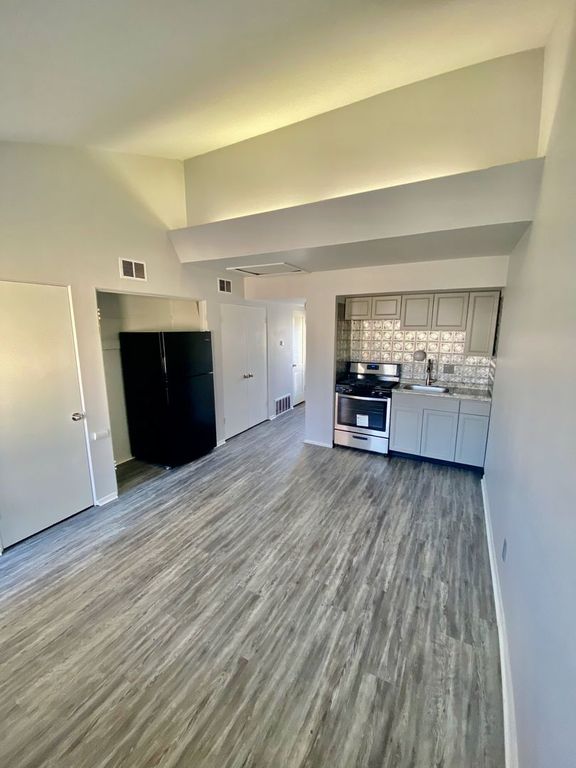
The height and width of the screenshot is (768, 576). I want to click on sink, so click(x=428, y=386).